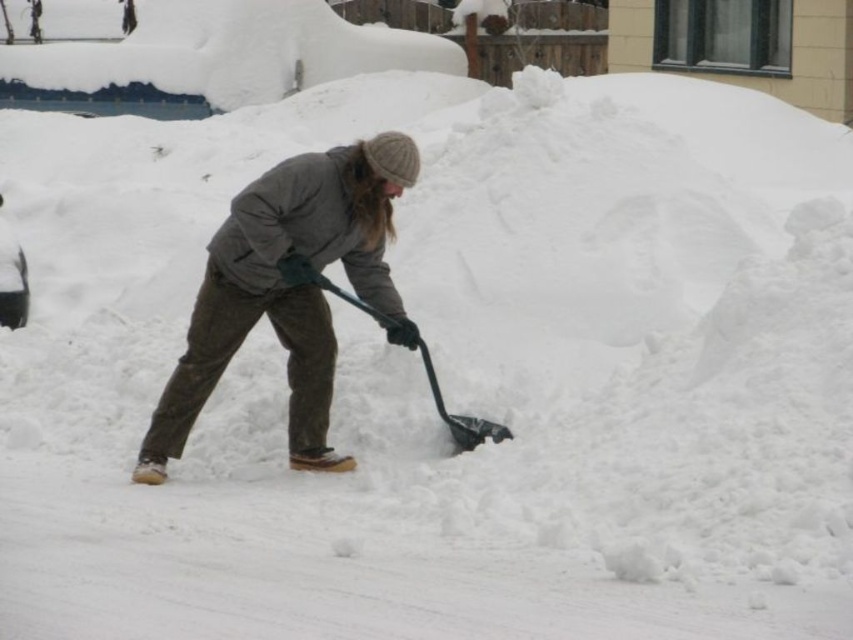
You are a weather reporter standing in the snow. You need to report on the snow depth. You see the dark gray woolen jacket at center and the black plastic shovel at center. Which object is taller?

The dark gray woolen jacket at center is taller than the black plastic shovel at center.

You are a photographer trying to capture the person clearing snow. Based on the scene, which object is closer to the camera between the dark gray woolen jacket at center and the black plastic shovel at center?

The dark gray woolen jacket at center is closer to the camera because it is in front of the black plastic shovel at center.

You are a delivery person trying to reach a package left on the ground near the driveway. You see the dark gray woolen jacket at center and the black plastic shovel at center. Which object is closer to the ground?

The black plastic shovel at center is closer to the ground because the dark gray woolen jacket at center is above it.